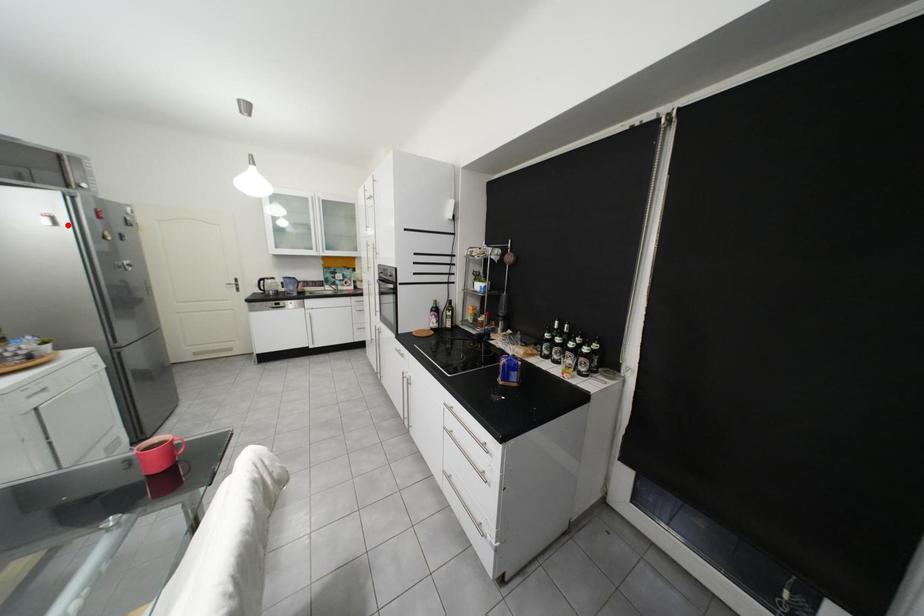
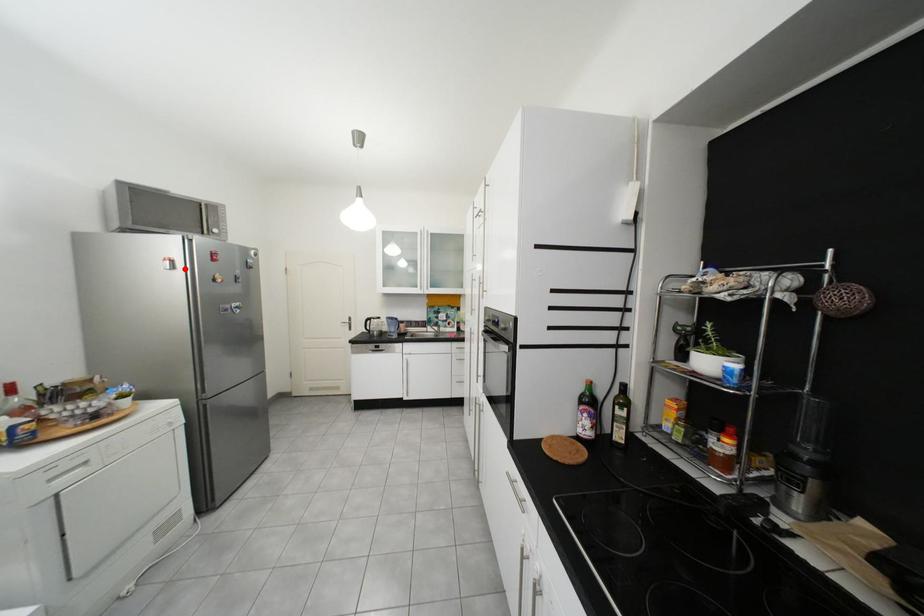
I am providing you with two images of the same scene from different viewpoints. A red point is marked on the first image and another point is marked on the second image. Does the point marked in image1 correspond to the same location as the one in image2?

Yes